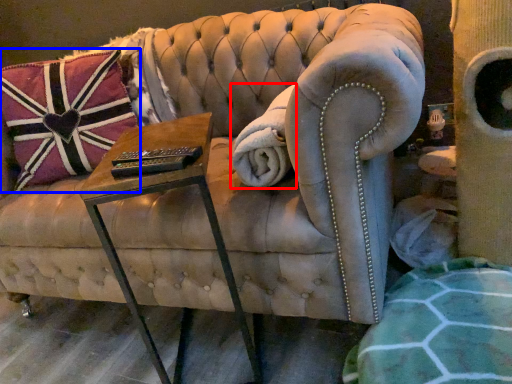
Question: Which of the following is the closest to the observer, blanket (highlighted by a red box) or pillow (highlighted by a blue box)?

Choices:
 (A) blanket
 (B) pillow

Answer: (A)